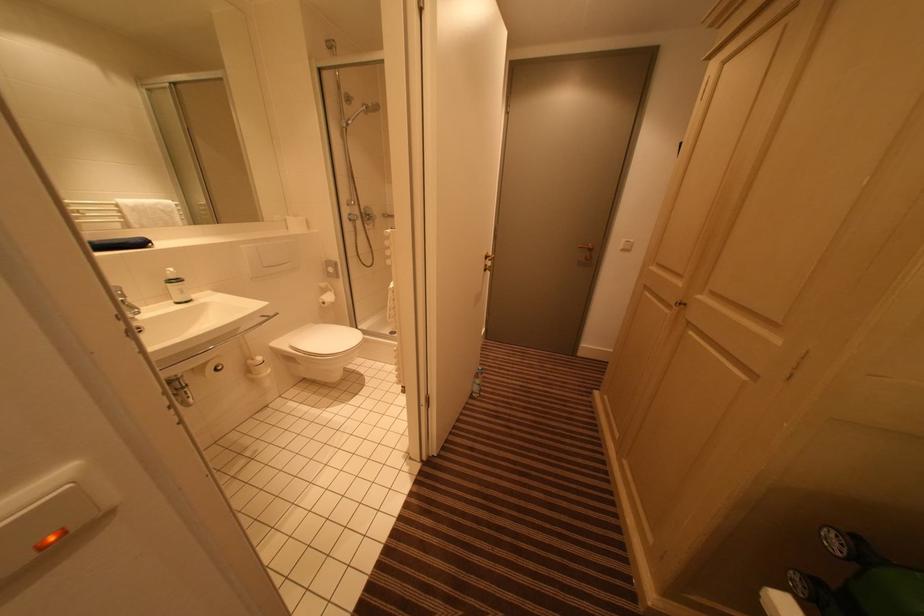
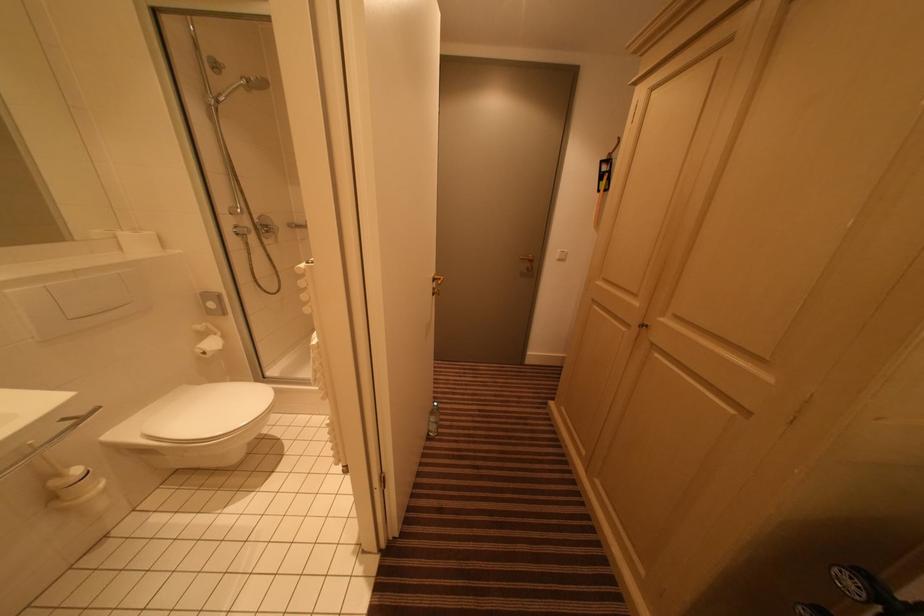
Question: The camera is either moving clockwise (left) or counter-clockwise (right) around the object. The first image is from the beginning of the video and the second image is from the end. Is the camera moving left or right when shooting the video?

Choices:
 (A) Left
 (B) Right

Answer: (A)